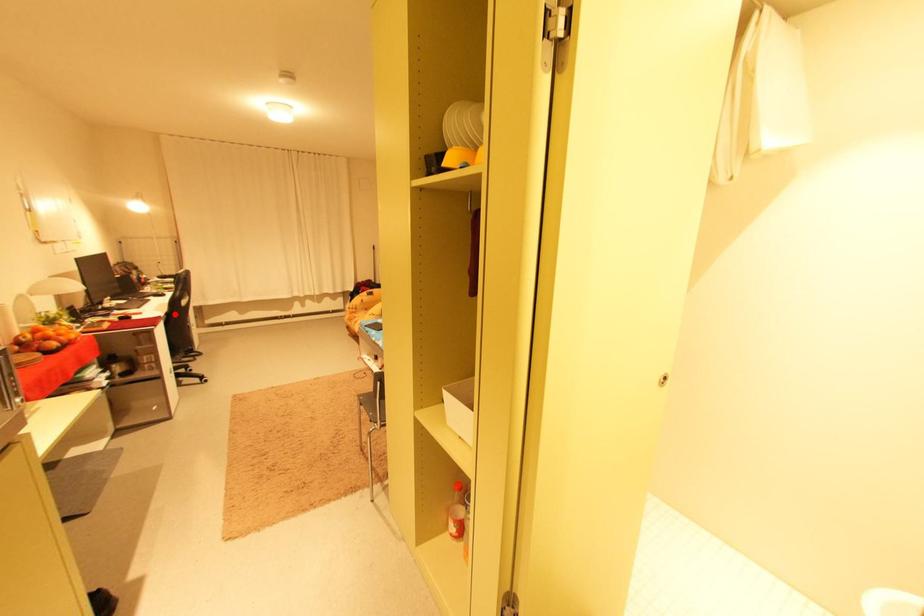
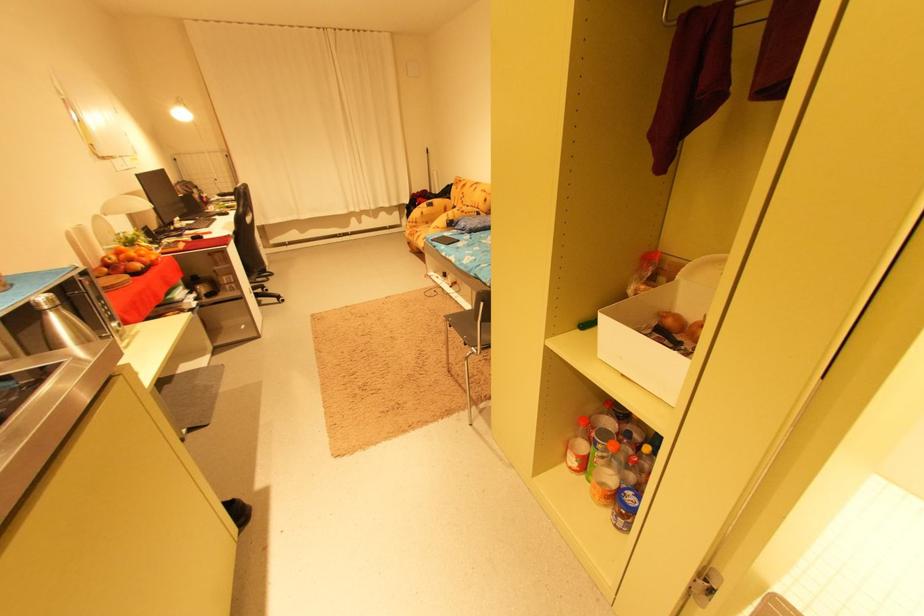
Question: I am providing you with two images of the same scene from different viewpoints. Given a red point in image1, look at the same physical point in image2. Is it:

Choices:
 (A) Closer to the viewpoint
 (B) Farther from the viewpoint

Answer: (A)